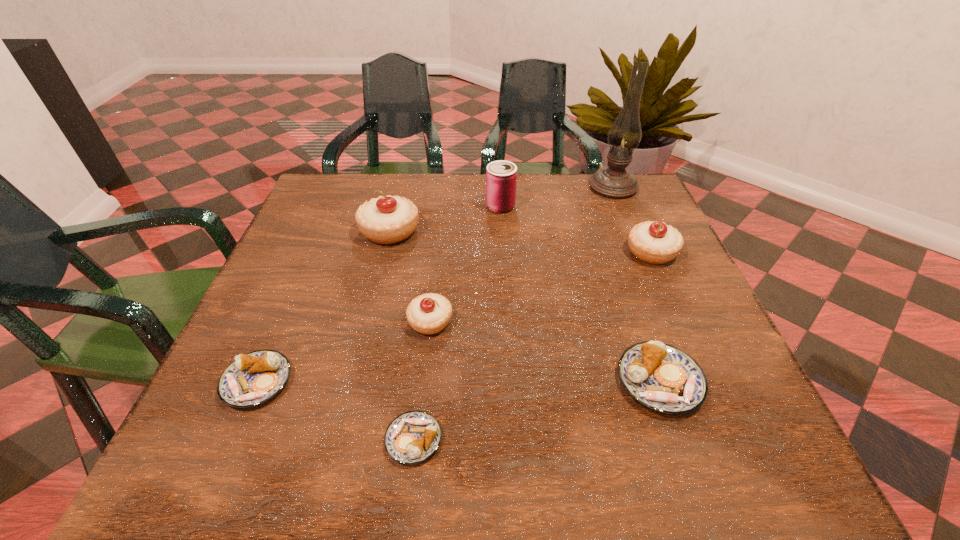
I want to click on object present at the far right corner, so click(613, 181).

Locate an element on the screen. vacant space at the far edge of the desktop is located at coordinates (446, 219).

In the image, there is a desktop. In order to click on vacant space at the left edge in this screenshot , I will do `click(300, 308)`.

Identify the location of free space at the right edge of the desktop. (616, 245).

Identify the location of free region at the far left corner. (317, 205).

I want to click on free spot between the shortest pastry and the second tallest pastry, so click(532, 346).

Locate an element on the screen. The image size is (960, 540). vacant space that is in between the second smallest brown pastry and the third shortest pastry is located at coordinates (458, 381).

Find the location of `free space between the second beige pastry from left to right and the fifth shortest pastry`. free space between the second beige pastry from left to right and the fifth shortest pastry is located at coordinates (540, 287).

This screenshot has width=960, height=540. Find the location of `free spot between the second smallest beige pastry and the smallest brown pastry`. free spot between the second smallest beige pastry and the smallest brown pastry is located at coordinates (532, 346).

Locate an element on the screen. The width and height of the screenshot is (960, 540). vacant region between the fifth object from left to right and the oil lamp is located at coordinates (557, 197).